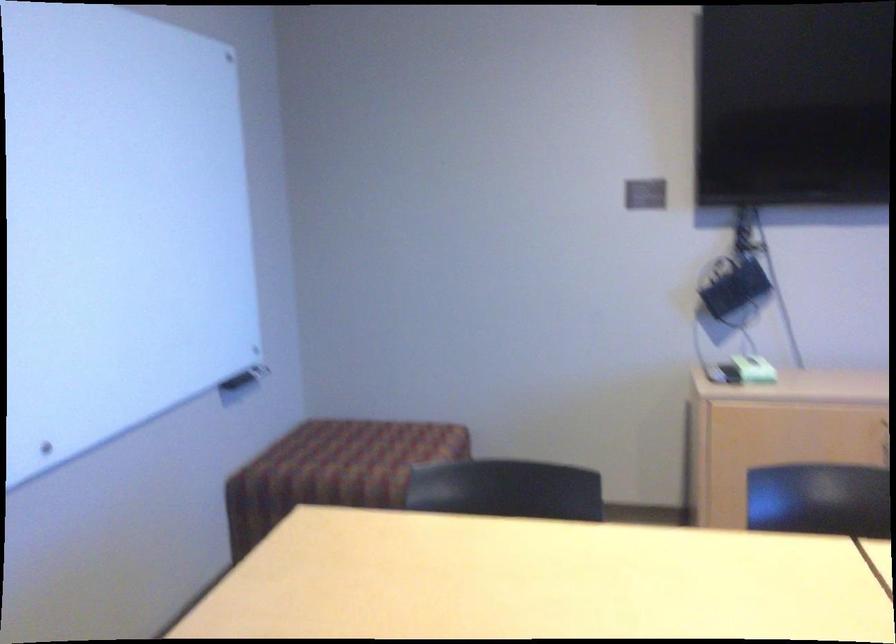
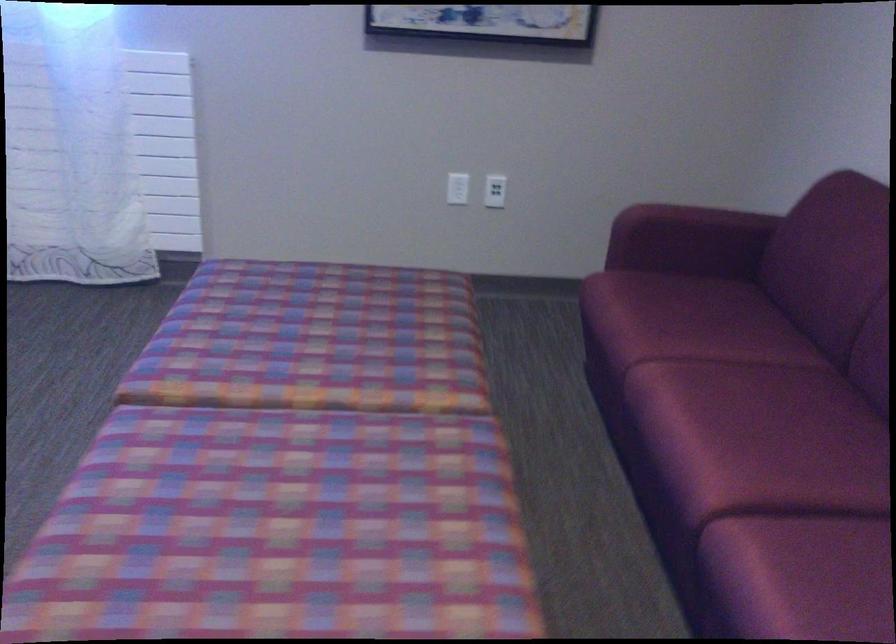
Based on the continuous images, in which direction is the camera rotating?

The rotation direction of the camera is right-down.